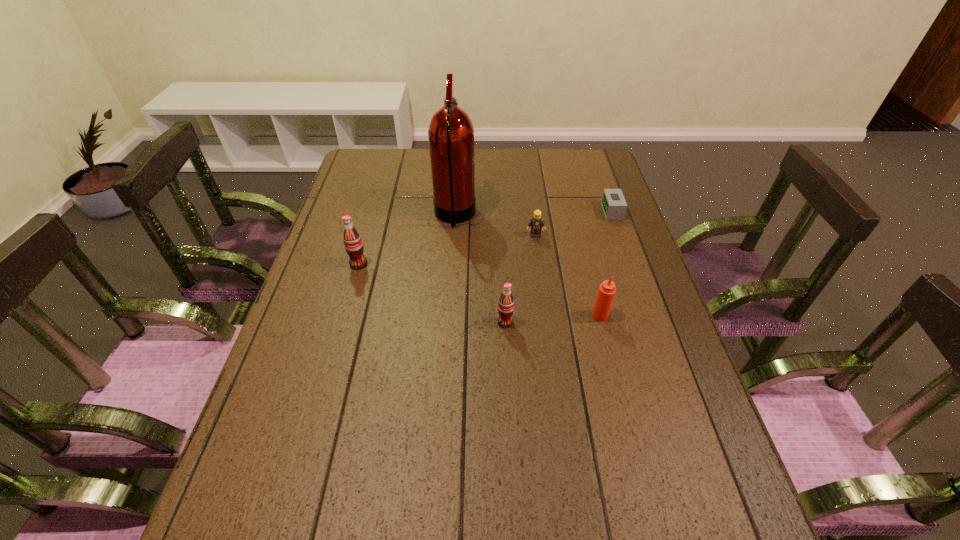
Locate an element on the screen. This screenshot has width=960, height=540. alarm clock located in the right edge section of the desktop is located at coordinates (613, 203).

The height and width of the screenshot is (540, 960). Find the location of `Tabasco sauce located in the right edge section of the desktop`. Tabasco sauce located in the right edge section of the desktop is located at coordinates (605, 296).

This screenshot has width=960, height=540. In the image, there is a desktop. Find the location of `vacant space at the far edge`. vacant space at the far edge is located at coordinates (528, 181).

Locate an element on the screen. free space at the near edge of the desktop is located at coordinates (559, 462).

In the image, there is a desktop. Where is `vacant space at the left edge`? vacant space at the left edge is located at coordinates (352, 205).

Where is `vacant space at the right edge of the desktop`? This screenshot has height=540, width=960. vacant space at the right edge of the desktop is located at coordinates (679, 403).

This screenshot has height=540, width=960. In order to click on vacant space at the near left corner in this screenshot , I will do `click(271, 458)`.

Locate an element on the screen. Image resolution: width=960 pixels, height=540 pixels. free space at the far right corner is located at coordinates (601, 178).

Image resolution: width=960 pixels, height=540 pixels. I want to click on free point between the fire extinguisher and the second shortest object, so click(495, 226).

You are a GUI agent. You are given a task and a screenshot of the screen. Output one action in this format:
    pyautogui.click(x=<x>, y=<y>)
    Task: Click on the free spot between the Tabasco sauce and the shortest object
    The image size is (960, 540).
    Given the screenshot: What is the action you would take?
    pyautogui.click(x=606, y=264)